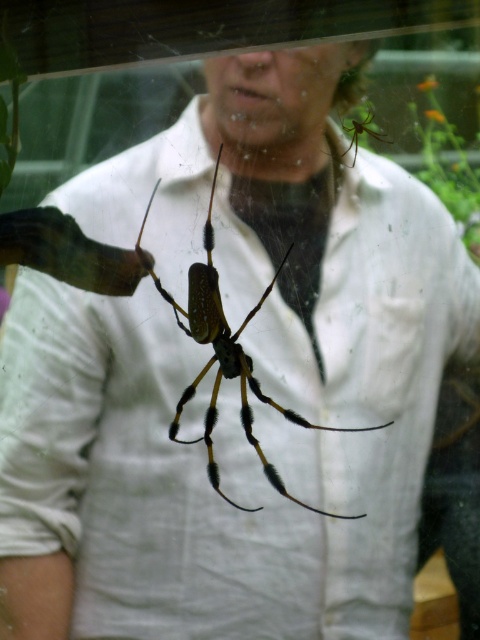
You are standing at the point marked as point (215, 177) and want to take a photo of the spider in the glass enclosure. The camera you have is 4.69 feet away from you. Can you reach the camera to take the photo?

The camera is 4.69 feet away from point (215, 177), so yes, you can reach the camera to take the photo since it is within a reasonable distance.

From the picture: You are a biologist examining two spiders in a display case. You notice the shiny metallic spider at center and the shiny green spider at upper right. Which spider is taller?

The shiny metallic spider at center is taller than the shiny green spider at upper right.

You are a biologist examining a display case with two spiders. You see the shiny metallic spider at center and the shiny green spider at upper right. Which spider is closer to your face?

The shiny metallic spider at center is closer to your face because it is positioned further to the viewer than the shiny green spider at upper right.